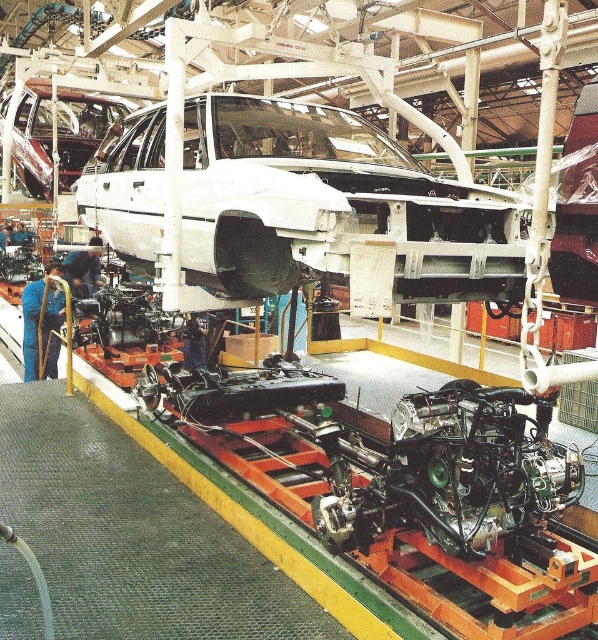
Can you confirm if white matte car at center is positioned to the left of shiny chrome car at upper left?

No, white matte car at center is not to the left of shiny chrome car at upper left.

Does point (451, 186) come behind point (44, 131)?

No.

Between point (316, 180) and point (96, 129), which one is positioned in front?

Point (316, 180) is more forward.

You are a GUI agent. You are given a task and a screenshot of the screen. Output one action in this format:
    pyautogui.click(x=<x>, y=<y>)
    Task: Click on the white matte car at center
    Image resolution: width=598 pixels, height=640 pixels.
    Given the screenshot: What is the action you would take?
    pyautogui.click(x=334, y=209)